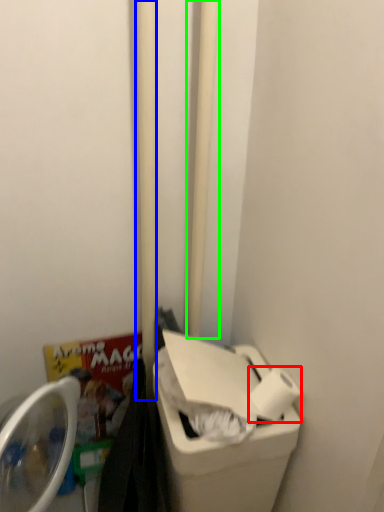
Question: Which object is positioned closest to toilet paper (highlighted by a red box)? Select from pole (highlighted by a blue box) and pole (highlighted by a green box).

Choices:
 (A) pole
 (B) pole

Answer: (A)